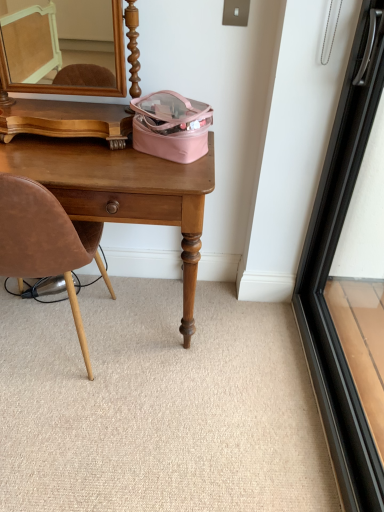
You are a GUI agent. You are given a task and a screenshot of the screen. Output one action in this format:
    pyautogui.click(x=<x>, y=<y>)
    Task: Click on the free point to the right of wooden desk at center
    This screenshot has width=384, height=512.
    Given the screenshot: What is the action you would take?
    pyautogui.click(x=247, y=358)